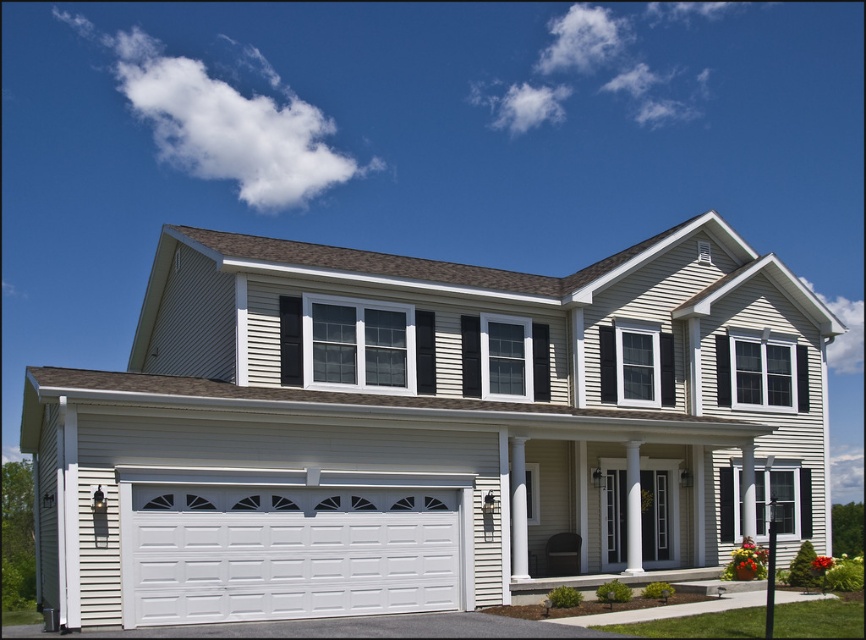
Who is lower down, white painted wood garage door at lower left or gray asphalt driveway at lower center?

Positioned lower is gray asphalt driveway at lower center.

Does point (462, 593) come closer to viewer compared to point (456, 634)?

No, (462, 593) is behind (456, 634).

What are the coordinates of `white painted wood garage door at lower left` in the screenshot? It's located at (425, 429).

Which of these two, white painted wood garage door at lower center or gray asphalt driveway at lower center, stands shorter?

With less height is white painted wood garage door at lower center.

Can you confirm if white painted wood garage door at lower center is bigger than gray asphalt driveway at lower center?

Incorrect, white painted wood garage door at lower center is not larger than gray asphalt driveway at lower center.

Identify the location of white painted wood garage door at lower center. (288, 552).

Who is positioned more to the right, white painted wood garage door at lower left or white painted wood garage door at lower center?

From the viewer's perspective, white painted wood garage door at lower left appears more on the right side.

Can you confirm if white painted wood garage door at lower left is bigger than white painted wood garage door at lower center?

Yes, white painted wood garage door at lower left is bigger than white painted wood garage door at lower center.

What do you see at coordinates (425, 429) in the screenshot? This screenshot has width=866, height=640. I see `white painted wood garage door at lower left` at bounding box center [425, 429].

At what (x,y) coordinates should I click in order to perform the action: click on white painted wood garage door at lower left. Please return your answer as a coordinate pair (x, y). This screenshot has height=640, width=866. Looking at the image, I should click on (425, 429).